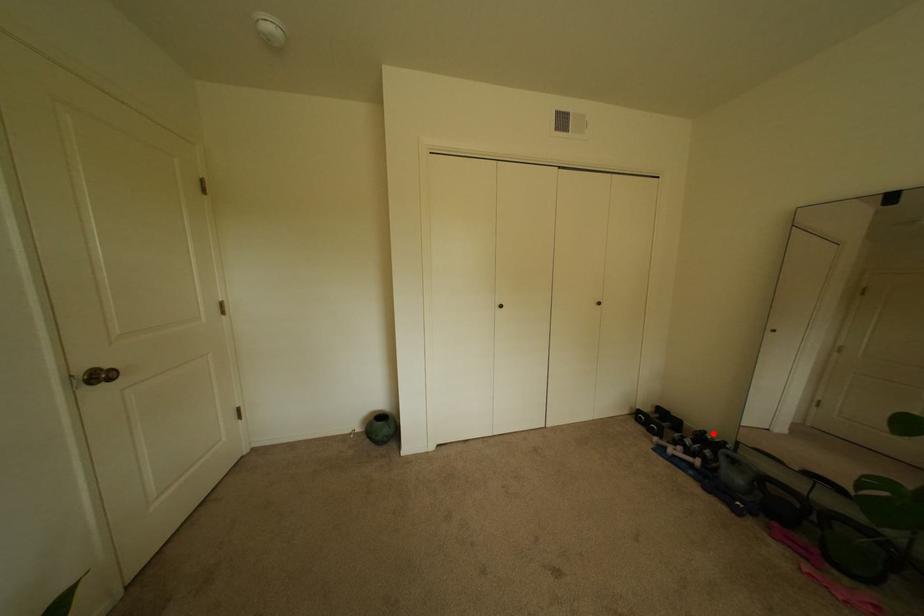
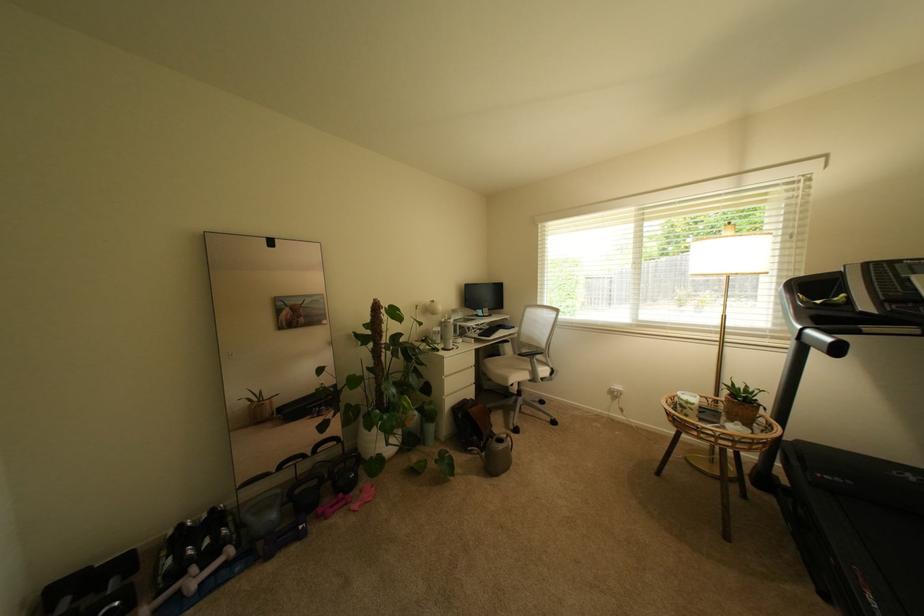
Find the pixel in the second image that matches the highlighted location in the first image.

(188, 527)